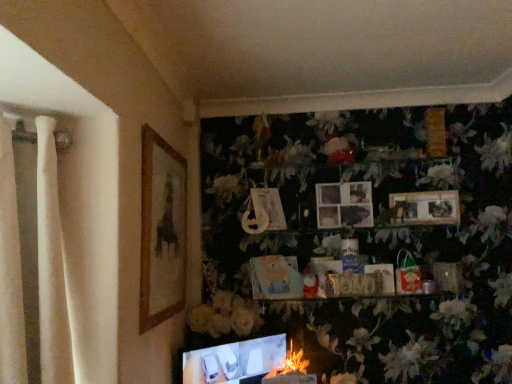
Question: Can you confirm if white matte flower at center, positioned as the first flower in left-to-right order, is bigger than wooden picture frame at left, the fifth picture frame positioned from the right?

Choices:
 (A) no
 (B) yes

Answer: (B)

Question: From the image's perspective, is white matte flower at center, the second flower when ordered from right to left, beneath wooden picture frame at left, the fifth picture frame positioned from the right?

Choices:
 (A) yes
 (B) no

Answer: (A)

Question: Can you confirm if white matte flower at center, acting as the 1th flower starting from the top, is taller than wooden picture frame at left, the fifth picture frame positioned from the right?

Choices:
 (A) yes
 (B) no

Answer: (B)

Question: Is white matte flower at center, positioned as the first flower in left-to-right order, smaller than wooden picture frame at left, the fifth picture frame positioned from the right?

Choices:
 (A) yes
 (B) no

Answer: (B)

Question: From a real-world perspective, does white matte flower at center, which ranks as the 2th flower in bottom-to-top order, sit lower than wooden picture frame at left, which is the first picture frame in left-to-right order?

Choices:
 (A) no
 (B) yes

Answer: (B)

Question: Considering the positions of matte black laptop at lower center and matte wooden picture frame at center, which is the fourth picture frame from left to right, in the image, is matte black laptop at lower center wider or thinner than matte wooden picture frame at center, which is the fourth picture frame from left to right,?

Choices:
 (A) wide
 (B) thin

Answer: (A)

Question: Is matte black laptop at lower center in front of or behind matte wooden picture frame at center, acting as the 2th picture frame starting from the right, in the image?

Choices:
 (A) behind
 (B) front

Answer: (B)

Question: Is matte black laptop at lower center taller or shorter than matte wooden picture frame at center, acting as the 2th picture frame starting from the right?

Choices:
 (A) short
 (B) tall

Answer: (B)

Question: Is point (280, 349) positioned closer to the camera than point (322, 221)?

Choices:
 (A) closer
 (B) farther

Answer: (A)

Question: Is white matte flower at center, positioned as the first flower in left-to-right order, taller or shorter than fluffy white flower at lower center, which ranks as the 1th flower in bottom-to-top order?

Choices:
 (A) tall
 (B) short

Answer: (A)

Question: From the image's perspective, relative to fluffy white flower at lower center, which is the 2th flower from top to bottom, is white matte flower at center, positioned as the first flower in left-to-right order, above or below?

Choices:
 (A) above
 (B) below

Answer: (A)

Question: Is point (258, 324) positioned closer to the camera than point (287, 365)?

Choices:
 (A) closer
 (B) farther

Answer: (B)

Question: From a real-world perspective, is white matte flower at center, acting as the 1th flower starting from the top, above or below fluffy white flower at lower center, which ranks as the 1th flower in bottom-to-top order?

Choices:
 (A) above
 (B) below

Answer: (A)

Question: From a real-world perspective, is matte plastic picture frame at center, the 2th picture frame viewed from the left, positioned above or below wooden photo frame at upper center, the fifth picture frame in the left-to-right sequence?

Choices:
 (A) below
 (B) above

Answer: (B)

Question: Is matte plastic picture frame at center, the fourth picture frame in the right-to-left sequence, in front of or behind wooden photo frame at upper center, the 1th picture frame in the right-to-left sequence, in the image?

Choices:
 (A) behind
 (B) front

Answer: (A)